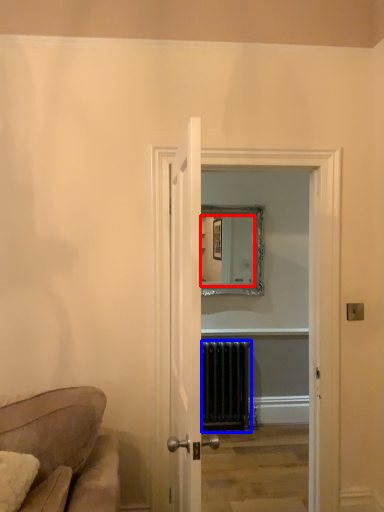
Question: Which object is closer to the camera taking this photo, mirror (highlighted by a red box) or radiator (highlighted by a blue box)?

Choices:
 (A) mirror
 (B) radiator

Answer: (B)